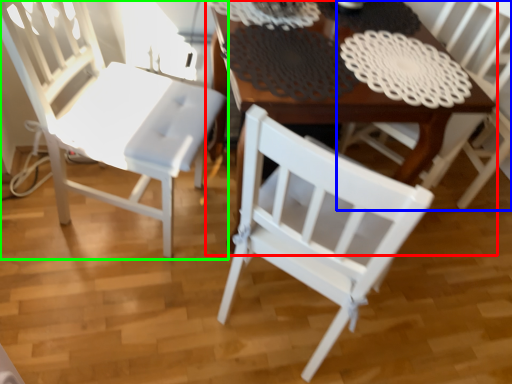
Question: Estimate the real-world distances between objects in this image. Which object is closer to table (highlighted by a red box), chair (highlighted by a blue box) or chair (highlighted by a green box)?

Choices:
 (A) chair
 (B) chair

Answer: (B)